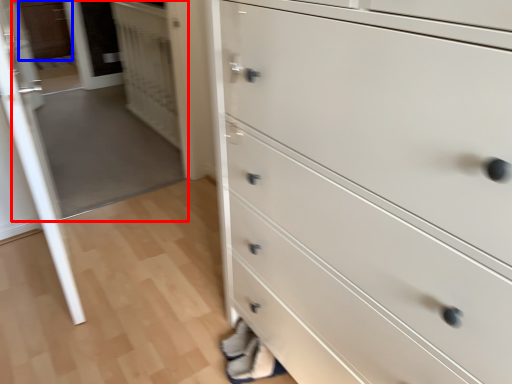
Question: Among these objects, which one is farthest to the camera, glass door (highlighted by a red box) or cabinetry (highlighted by a blue box)?

Choices:
 (A) glass door
 (B) cabinetry

Answer: (B)